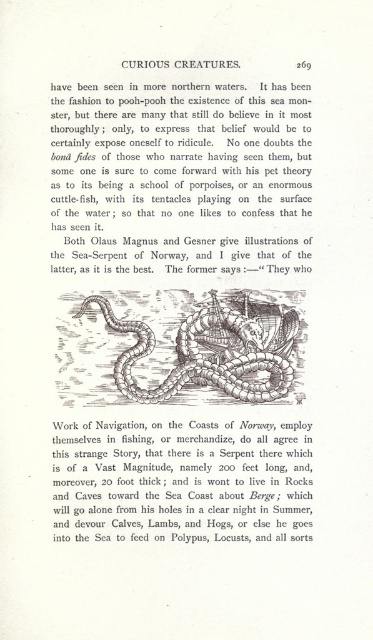
You are a photographer standing at the camera position. You want to take a closeup photo of the point at coordinate point (214,214). The camera has a focal length of 50mm. What is the approximate distance in feet between you and the point?

The distance of point (214,214) from camera is 4.89 feet, so you are approximately 4.89 feet away from the point.